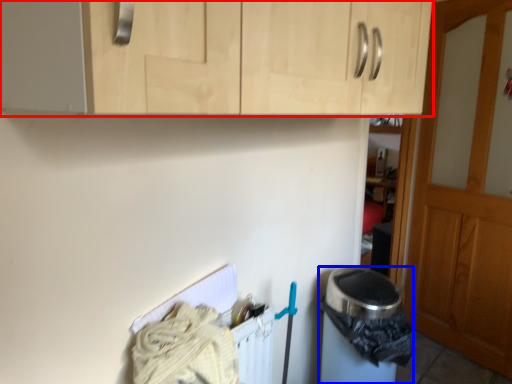
Question: Which point is further to the camera, cabinetry (highlighted by a red box) or appliance (highlighted by a blue box)?

Choices:
 (A) cabinetry
 (B) appliance

Answer: (B)